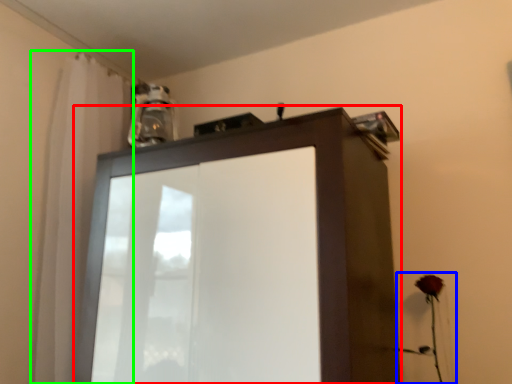
Question: Based on their relative distances, which object is nearer to cupboard (highlighted by a red box)? Choose from flower (highlighted by a blue box) and shower curtain (highlighted by a green box).

Choices:
 (A) flower
 (B) shower curtain

Answer: (B)